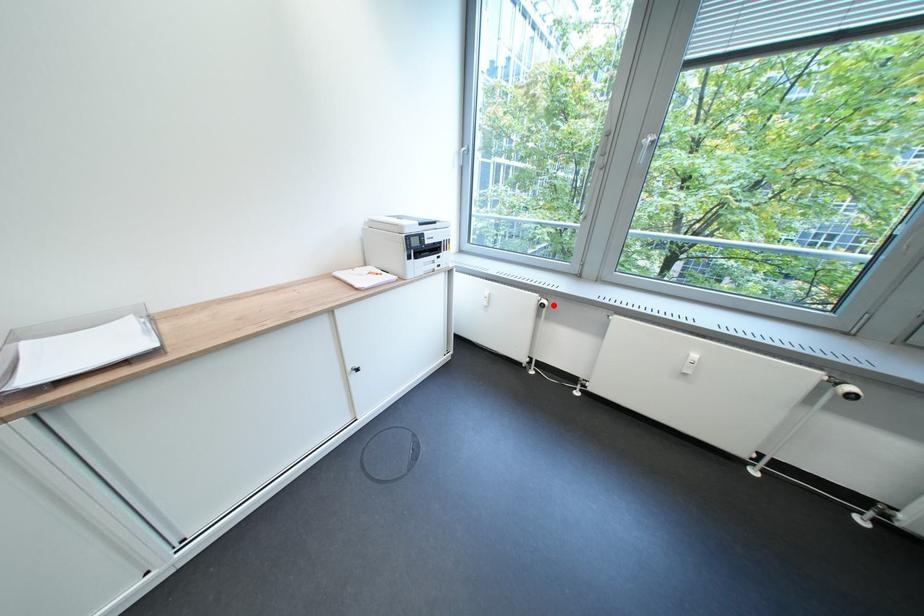
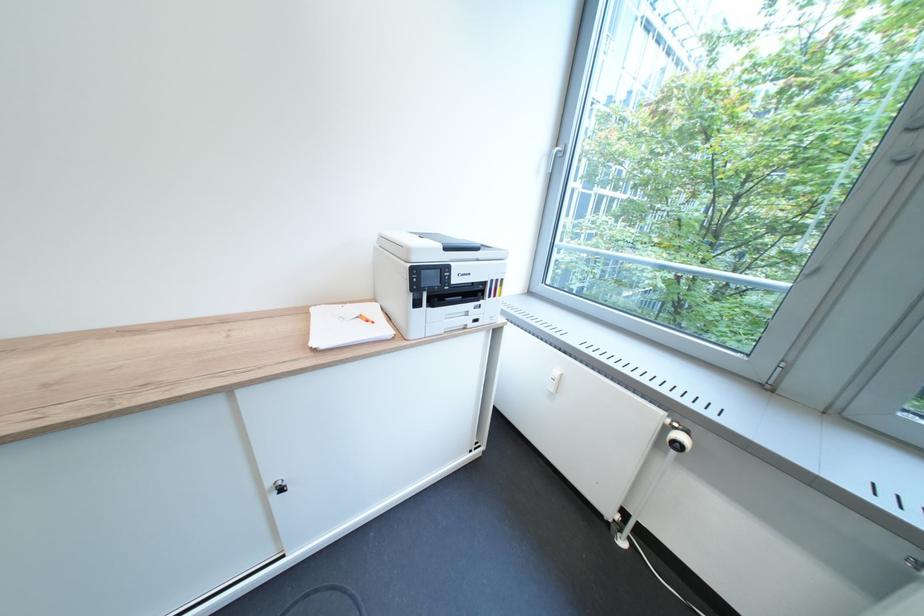
The point at the highlighted location is marked in the first image. Where is the corresponding point in the second image?

(687, 443)